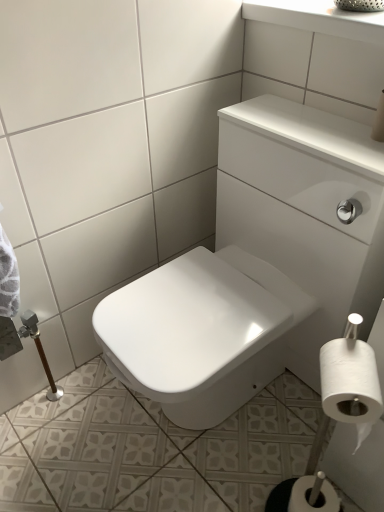
Question: Is white matte toilet paper at lower right, positioned as the second toilet paper in front-to-back order, not close to white matte toilet paper at lower right, which is the second toilet paper in back-to-front order?

Choices:
 (A) yes
 (B) no

Answer: (B)

Question: Considering the relative positions of white matte toilet paper at lower right, arranged as the second toilet paper when viewed from the top, and white matte toilet paper at lower right, which is the second toilet paper in back-to-front order, in the image provided, is white matte toilet paper at lower right, arranged as the second toilet paper when viewed from the top, in front of white matte toilet paper at lower right, which is the second toilet paper in back-to-front order,?

Choices:
 (A) yes
 (B) no

Answer: (B)

Question: Is white matte toilet paper at lower right, arranged as the second toilet paper when viewed from the top, next to white matte toilet paper at lower right, acting as the first toilet paper starting from the top, and touching it?

Choices:
 (A) yes
 (B) no

Answer: (B)

Question: Is white matte toilet paper at lower right, the 1th toilet paper from the back, oriented towards white matte toilet paper at lower right, acting as the 2th toilet paper starting from the bottom?

Choices:
 (A) no
 (B) yes

Answer: (A)

Question: Is white matte toilet paper at lower right, positioned as the second toilet paper in front-to-back order, positioned with its back to white matte toilet paper at lower right, acting as the first toilet paper starting from the top?

Choices:
 (A) no
 (B) yes

Answer: (A)

Question: From a real-world perspective, is white matte toilet paper at lower right, which appears as the first toilet paper when ordered from the bottom, located beneath white matte toilet paper at lower right, which is the second toilet paper in back-to-front order?

Choices:
 (A) yes
 (B) no

Answer: (A)

Question: Considering the relative sizes of white matte toilet paper at lower right, arranged as the second toilet paper when viewed from the top, and white glossy sink at upper center in the image provided, is white matte toilet paper at lower right, arranged as the second toilet paper when viewed from the top, wider than white glossy sink at upper center?

Choices:
 (A) yes
 (B) no

Answer: (B)

Question: Is white glossy sink at upper center at the back of white matte toilet paper at lower right, the 1th toilet paper from the back?

Choices:
 (A) yes
 (B) no

Answer: (B)

Question: Does white matte toilet paper at lower right, the 1th toilet paper from the back, have a lesser height compared to white glossy sink at upper center?

Choices:
 (A) no
 (B) yes

Answer: (B)

Question: Is white matte toilet paper at lower right, which appears as the first toilet paper when ordered from the bottom, at the left side of white glossy sink at upper center?

Choices:
 (A) yes
 (B) no

Answer: (B)

Question: Is white matte toilet paper at lower right, the 1th toilet paper from the back, aimed at white glossy sink at upper center?

Choices:
 (A) no
 (B) yes

Answer: (A)

Question: Considering the relative sizes of white matte toilet paper at lower right, arranged as the second toilet paper when viewed from the top, and white glossy sink at upper center in the image provided, is white matte toilet paper at lower right, arranged as the second toilet paper when viewed from the top, thinner than white glossy sink at upper center?

Choices:
 (A) yes
 (B) no

Answer: (A)

Question: Does white glossy sink at upper center have a larger size compared to white matte toilet paper at lower right, the 1th toilet paper from the back?

Choices:
 (A) no
 (B) yes

Answer: (B)